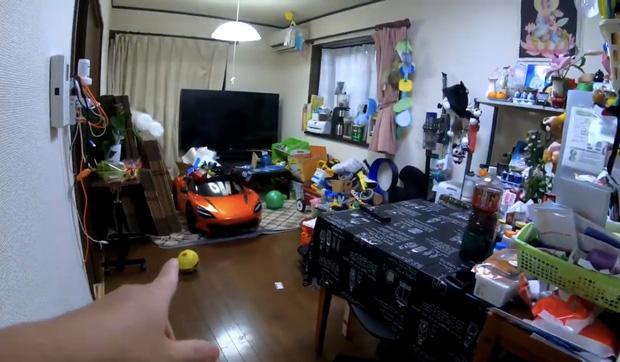
At what (x,y) coordinates should I click in order to perform the action: click on table. Please return your answer as a coordinate pair (x, y). Looking at the image, I should click on (422, 239).